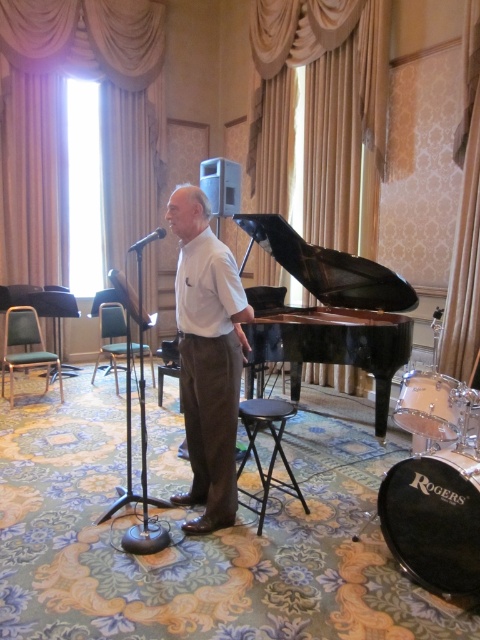
You are standing at the entrance of the room and see the point marked as point (x=272, y=452). What object is located at that coordinate?

The point (x=272, y=452) corresponds to the black plastic stool at center.

You are an event planner setting up a stage for a performance. The stage has a man dressed in a white shirt and dark trousers standing near a microphone stand. You need to place a decorative centerpiece exactly at the point marked as point (207,356). Where should you place the centerpiece relative to the man?

The white smooth shirt at center is located at point (207,356), so you should place the decorative centerpiece exactly where the man is standing, at the white smooth shirt at center.

You are setting up a small performance area and need to place the black plastic stool at center and the black metallic microphone at center. Given their sizes, which object should be placed first to ensure proper positioning?

The black plastic stool at center has a smaller width than the black metallic microphone at center, so it should be placed first to ensure there is enough space for the wider microphone.